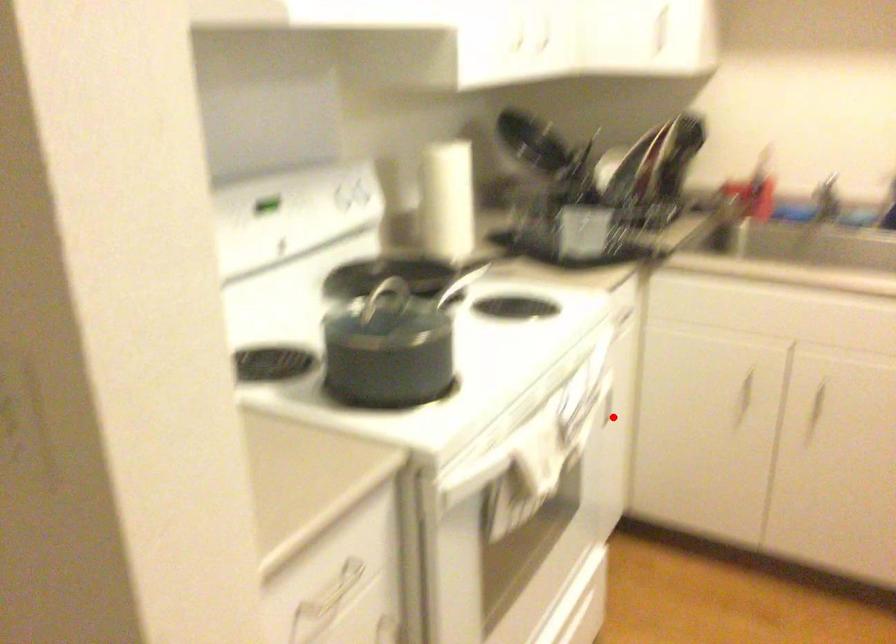
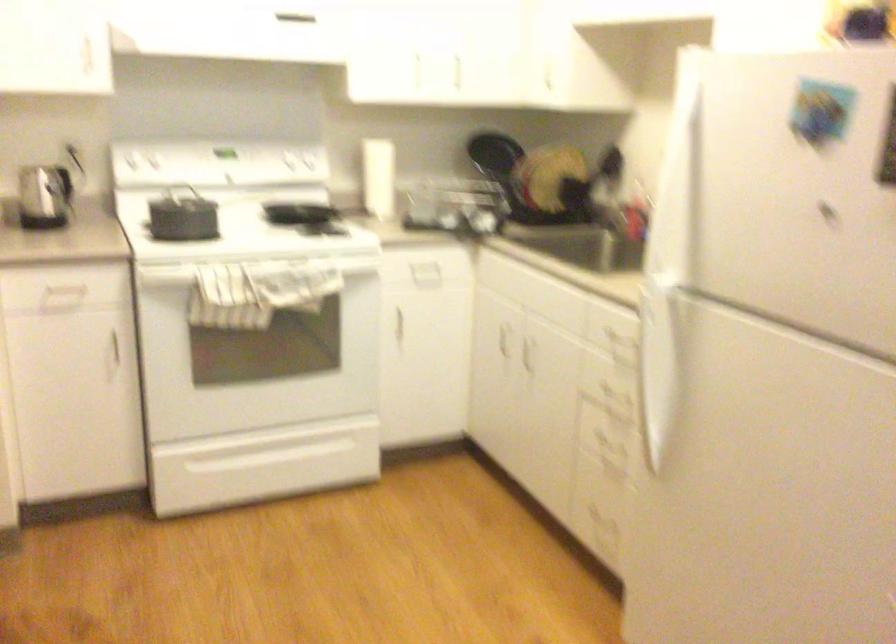
Locate, in the second image, the point that corresponds to the highlighted location in the first image.

(425, 342)